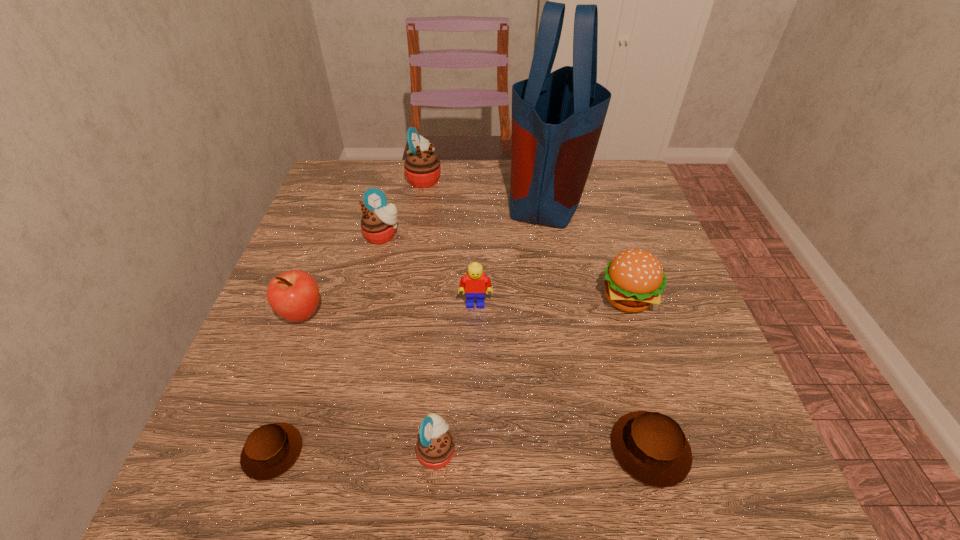
This screenshot has width=960, height=540. In order to click on vacant space positioned on the front-facing side of the yellow Lego in this screenshot , I will do `click(475, 337)`.

You are a GUI agent. You are given a task and a screenshot of the screen. Output one action in this format:
    pyautogui.click(x=<x>, y=<y>)
    Task: Click on the vacant space situated on the front-facing side of the nearest pink muffin
    This screenshot has width=960, height=540.
    Given the screenshot: What is the action you would take?
    pyautogui.click(x=632, y=450)

Locate an element on the screen. The image size is (960, 540). vacant space positioned on the back of the eighth tallest object is located at coordinates pos(598,263).

You are a GUI agent. You are given a task and a screenshot of the screen. Output one action in this format:
    pyautogui.click(x=<x>, y=<y>)
    Task: Click on the vacant space located on the right of the shortest object
    
    Given the screenshot: What is the action you would take?
    pyautogui.click(x=399, y=451)

Where is `handbag located at the far edge`? The image size is (960, 540). handbag located at the far edge is located at coordinates (557, 117).

Locate an element on the screen. The height and width of the screenshot is (540, 960). muffin at the far edge is located at coordinates (422, 167).

You are a GUI agent. You are given a task and a screenshot of the screen. Output one action in this format:
    pyautogui.click(x=<x>, y=<y>)
    Task: Click on the apple present at the left edge
    The image size is (960, 540).
    Given the screenshot: What is the action you would take?
    pyautogui.click(x=294, y=295)

The width and height of the screenshot is (960, 540). What are the coordinates of `handbag that is at the right edge` in the screenshot? It's located at (557, 117).

You are a GUI agent. You are given a task and a screenshot of the screen. Output one action in this format:
    pyautogui.click(x=<x>, y=<y>)
    Task: Click on the hamburger that is positioned at the right edge
    This screenshot has height=540, width=960.
    Given the screenshot: What is the action you would take?
    pyautogui.click(x=634, y=279)

I want to click on muffin that is at the right edge, so click(x=651, y=447).